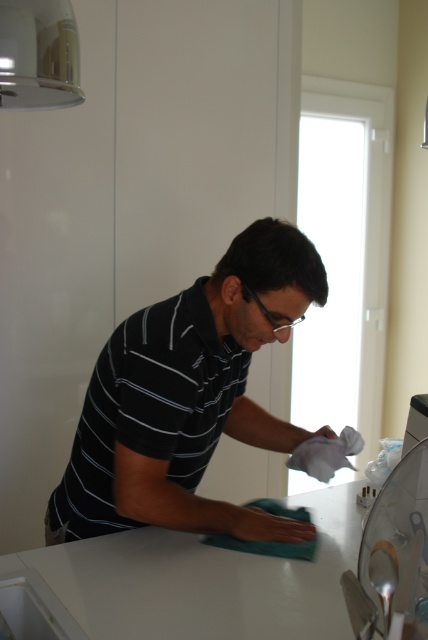
Measure the distance between point (x=222, y=280) and camera.

Point (x=222, y=280) and camera are 4.08 feet apart from each other.

What do you see at coordinates (189, 397) in the screenshot?
I see `black striped shirt at center` at bounding box center [189, 397].

The width and height of the screenshot is (428, 640). Find the location of `black striped shirt at center`. black striped shirt at center is located at coordinates (189, 397).